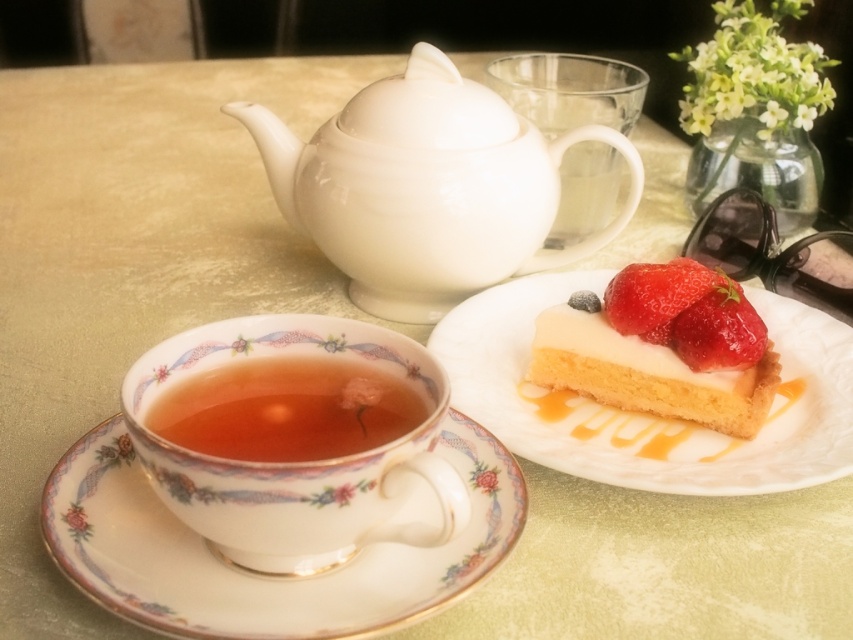
Can you confirm if translucent glass cup at center is positioned above shiny red strawberry at upper right?

Result: Actually, translucent glass cup at center is below shiny red strawberry at upper right.

Between translucent glass cup at center and shiny red strawberry at upper right, which one has more height?

shiny red strawberry at upper right is taller.

Describe the element at coordinates (286, 410) in the screenshot. I see `translucent glass cup at center` at that location.

Locate an element on the screen. Image resolution: width=853 pixels, height=640 pixels. translucent glass cup at center is located at coordinates (286, 410).

Does white glossy teapot at upper center have a smaller size compared to shiny red strawberry at upper right?

No.

Is point (433, 314) behind point (683, 307)?

Yes, it is behind point (683, 307).

Locate an element on the screen. The width and height of the screenshot is (853, 640). white glossy teapot at upper center is located at coordinates (427, 188).

Which is more to the right, porcelain cup at lower left or shiny red strawberry at right?

From the viewer's perspective, shiny red strawberry at right appears more on the right side.

Who is more distant from viewer, (244, 340) or (741, 298)?

The point (741, 298) is behind.

You are a GUI agent. You are given a task and a screenshot of the screen. Output one action in this format:
    pyautogui.click(x=<x>, y=<y>)
    Task: Click on the porcelain cup at lower left
    This screenshot has width=853, height=640.
    Given the screenshot: What is the action you would take?
    pyautogui.click(x=299, y=461)